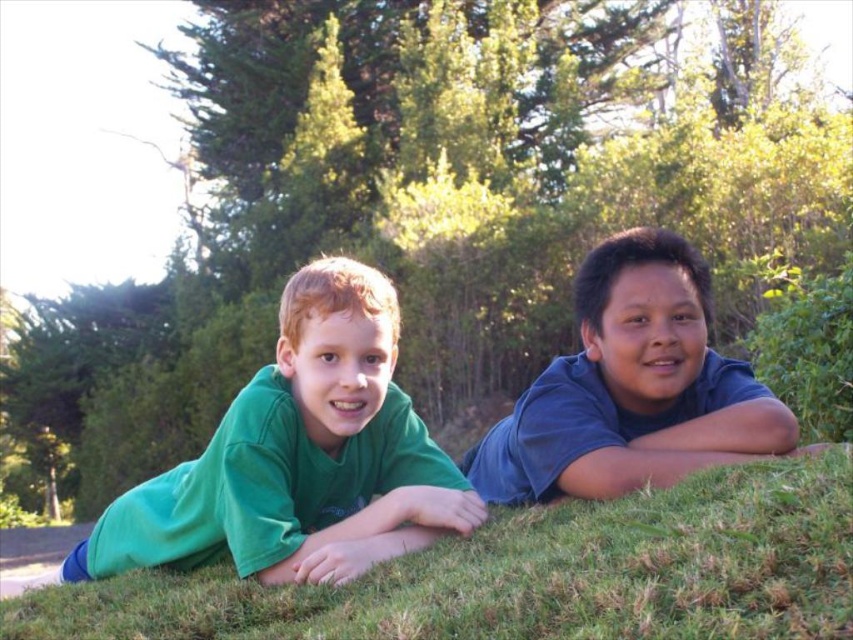
Which of these two, green grass at lower center or blue cotton shirt at center, stands taller?

Standing taller between the two is blue cotton shirt at center.

Is green grass at lower center taller than blue cotton shirt at center?

No.

Does point (428, 612) come behind point (767, 424)?

No.

Identify the location of green grass at lower center. This screenshot has width=853, height=640. (534, 576).

Does point (485, 561) lie behind point (398, 454)?

That is False.

The height and width of the screenshot is (640, 853). Describe the element at coordinates (534, 576) in the screenshot. I see `green grass at lower center` at that location.

Is point (126, 630) farther from camera compared to point (384, 506)?

That is False.

This screenshot has width=853, height=640. I want to click on green grass at lower center, so click(x=534, y=576).

Which is more to the left, green matte shirt at left or blue cotton shirt at center?

green matte shirt at left is more to the left.

Does green matte shirt at left have a smaller size compared to blue cotton shirt at center?

No.

The height and width of the screenshot is (640, 853). In order to click on green matte shirt at left in this screenshot , I will do `click(300, 456)`.

Find the location of a particular element. The image size is (853, 640). green matte shirt at left is located at coordinates (300, 456).